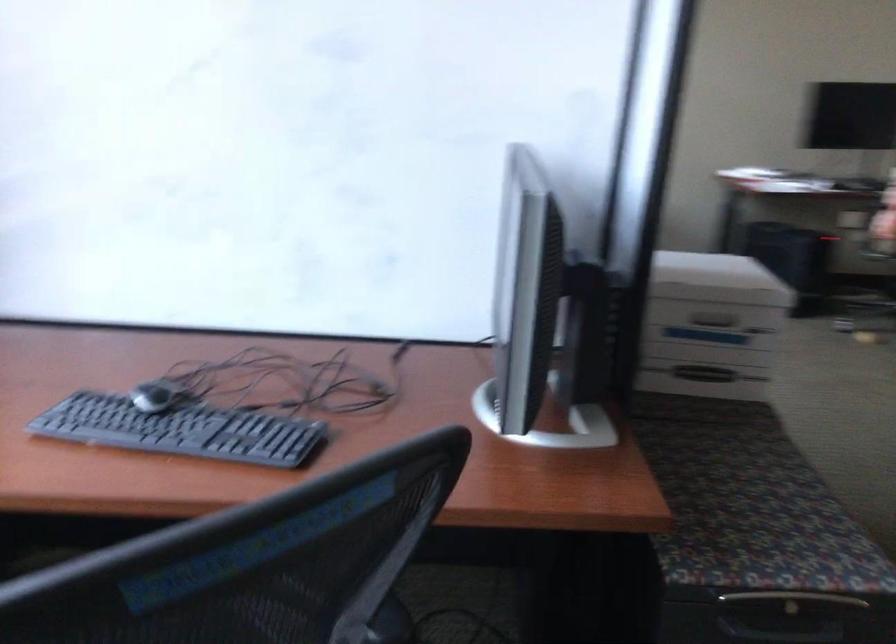
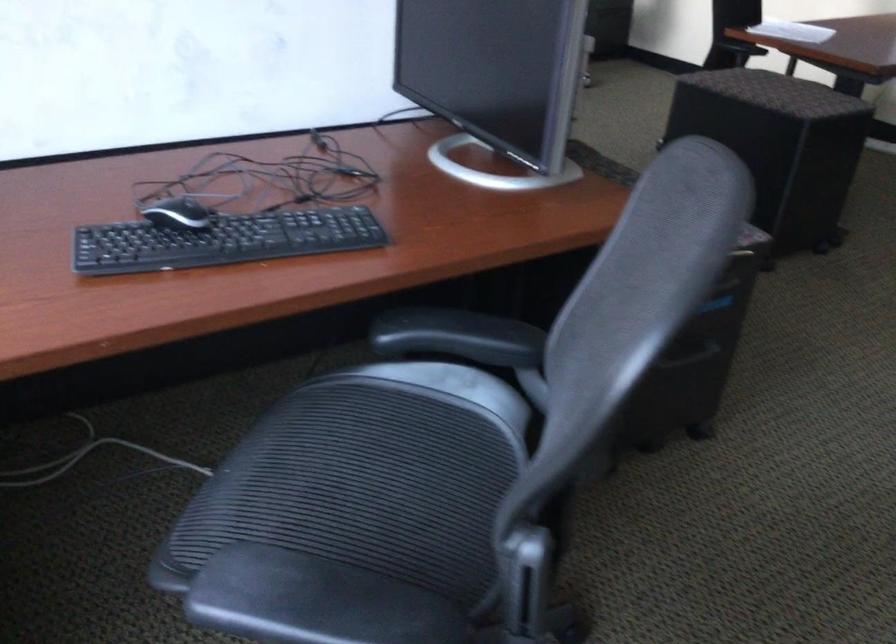
Locate, in the second image, the point that corresponds to (167,424) in the first image.

(222, 240)